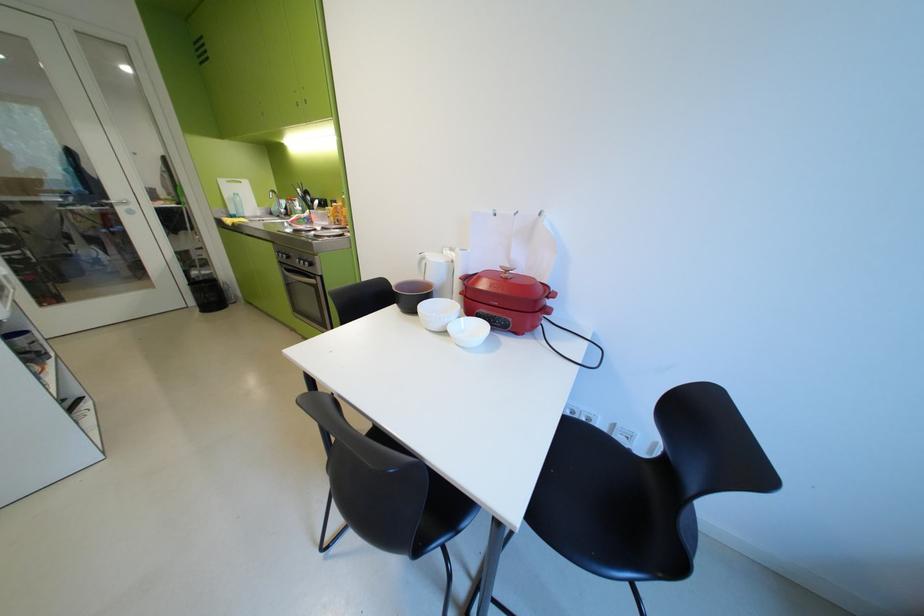
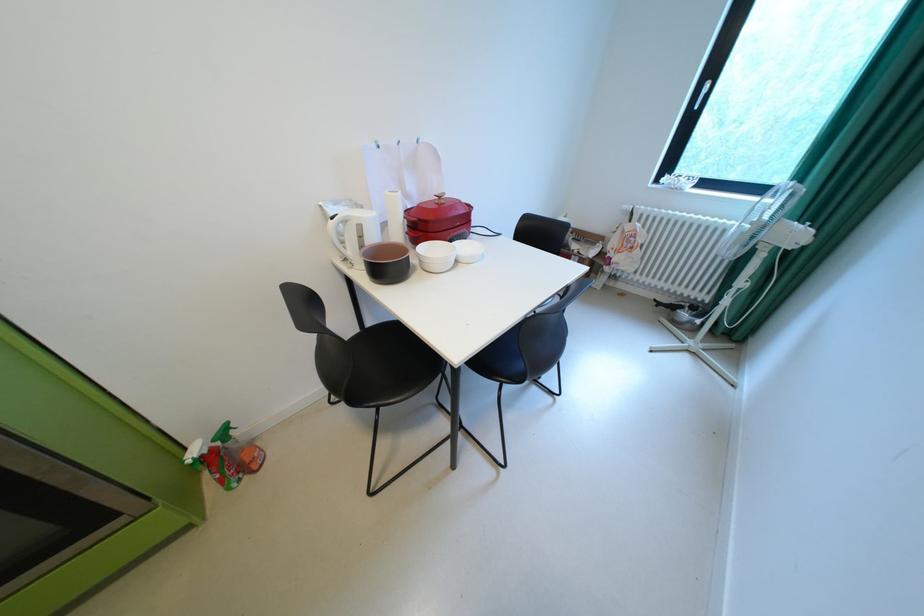
Locate, in the second image, the point that corresponds to (517,272) in the first image.

(450, 198)